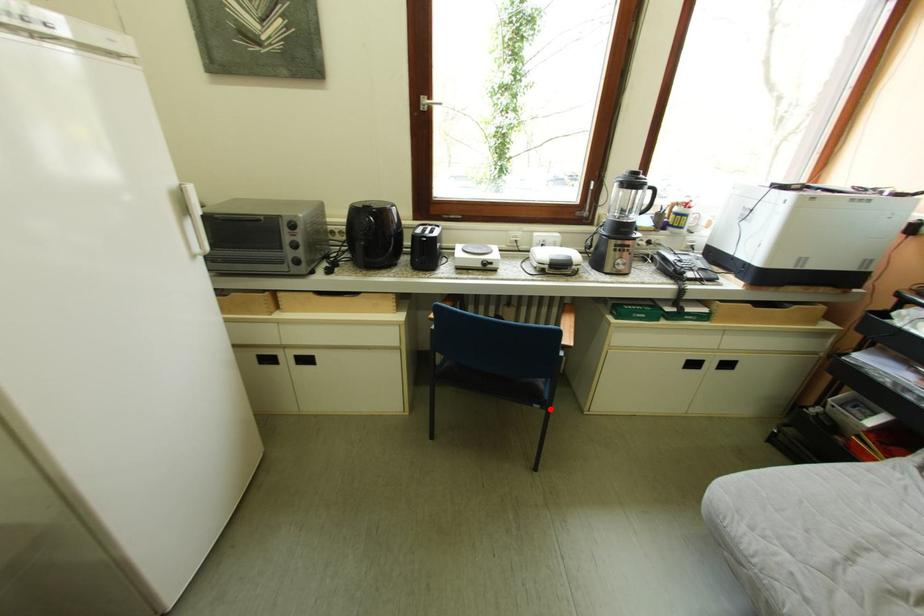
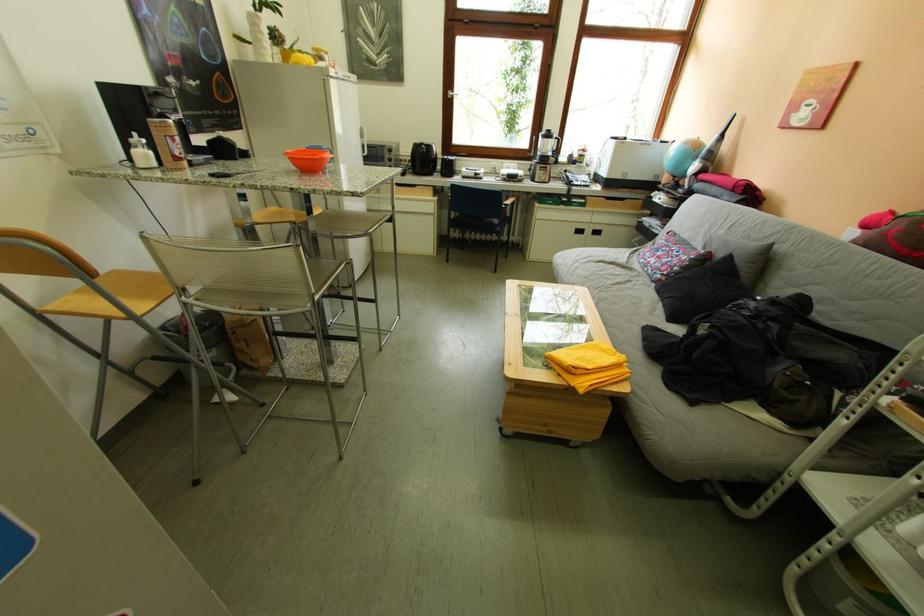
Question: I am providing you with two images of the same scene from different viewpoints. A red point is marked on the first image. Is the red point's position out of view in image 2?

Choices:
 (A) Yes
 (B) No

Answer: (B)